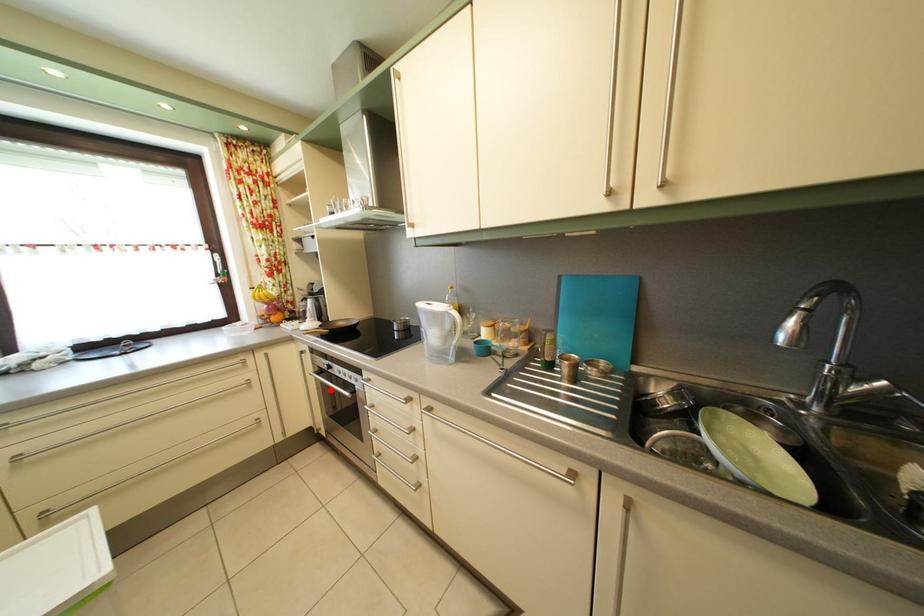
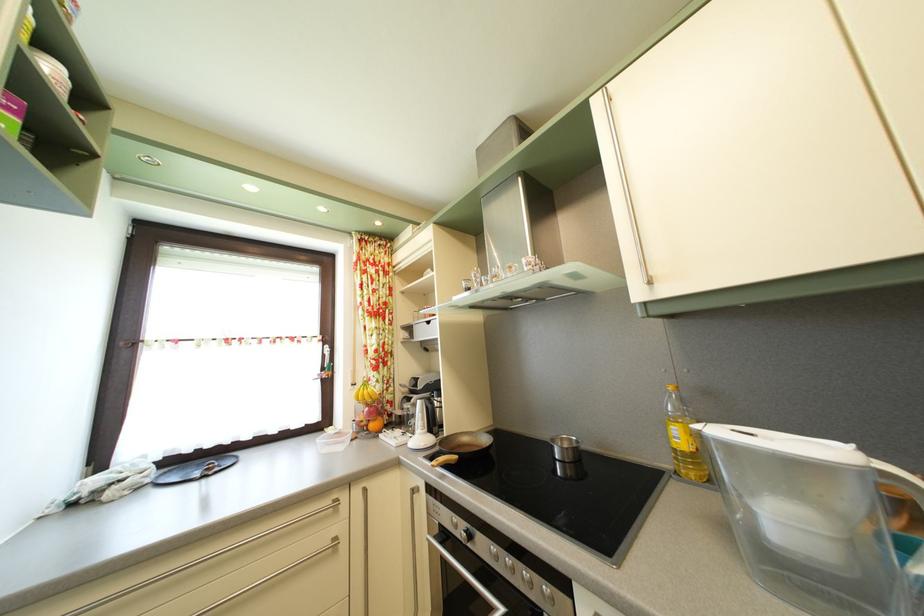
Question: A red point is marked in image1. In image2, is the corresponding 3D point closer to the camera or farther? Reply with the corresponding letter.

Choices:
 (A) The corresponding 3D point is closer.
 (B) The corresponding 3D point is farther.

Answer: (A)